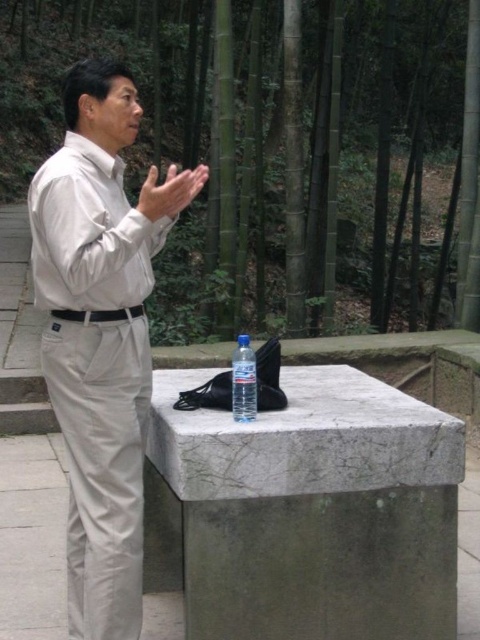
You are a photographer trying to capture the scene from the front. The matte white hand at center and the clear plastic bottle at center are in your frame. Based on their sizes in the image, which object would appear larger?

The matte white hand at center appears larger because it is taller than the clear plastic bottle at center.

You are a photographer aiming to capture the clear plastic bottle at center without the matte beige shirt at center blocking it. How should you adjust your camera angle?

The matte beige shirt at center is positioned over the clear plastic bottle at center, so to avoid blocking the bottle, you should lower your camera angle to look underneath the shirt.